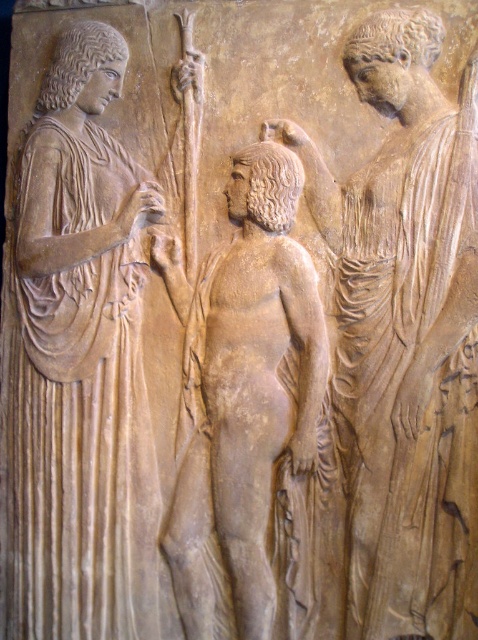
Which of these two, matte beige robe at left or beige stone figure at center, stands taller?

matte beige robe at left

I want to click on matte beige robe at left, so click(79, 364).

Is point (33, 518) farther from viewer compared to point (268, 461)?

Yes, it is.

In order to click on matte beige robe at left in this screenshot , I will do `click(79, 364)`.

Measure the distance from matte stone figure at center to beige stone figure at center.

They are 7.36 inches apart.

Does matte stone figure at center appear under beige stone figure at center?

No.

Where is `matte stone figure at center`? This screenshot has width=478, height=640. matte stone figure at center is located at coordinates (405, 333).

Find the location of a particular element. matte stone figure at center is located at coordinates (405, 333).

Does point (391, 580) lie behind point (91, 332)?

No, (391, 580) is closer to viewer.

Between matte stone figure at center and matte beige robe at left, which one appears on the left side from the viewer's perspective?

matte beige robe at left

Which is behind, point (435, 522) or point (97, 358)?

The point (97, 358) is more distant.

The height and width of the screenshot is (640, 478). In order to click on matte stone figure at center in this screenshot , I will do `click(405, 333)`.